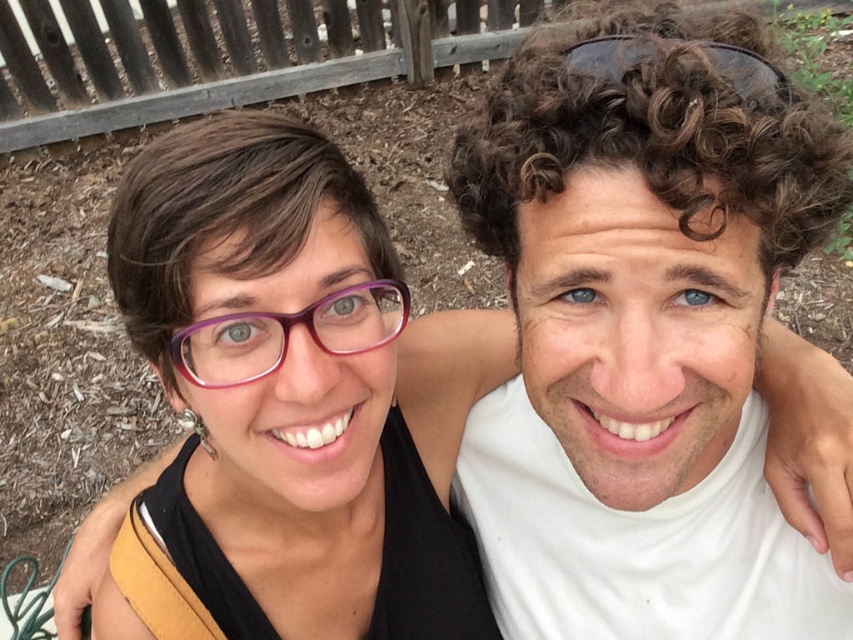
Is matte black tank top at center below purple acetate glasses at center?

Indeed, matte black tank top at center is positioned under purple acetate glasses at center.

Does matte black tank top at center have a larger size compared to purple acetate glasses at center?

Yes, matte black tank top at center is bigger than purple acetate glasses at center.

You are a GUI agent. You are given a task and a screenshot of the screen. Output one action in this format:
    pyautogui.click(x=<x>, y=<y>)
    Task: Click on the matte black tank top at center
    The image size is (853, 640).
    Given the screenshot: What is the action you would take?
    pyautogui.click(x=289, y=401)

Is purple acetate glasses at center bigger than sunglasses at upper center?

Correct, purple acetate glasses at center is larger in size than sunglasses at upper center.

Is purple acetate glasses at center to the right of sunglasses at upper center from the viewer's perspective?

Incorrect, purple acetate glasses at center is not on the right side of sunglasses at upper center.

Between point (387, 289) and point (757, 99), which one is positioned in front?

Point (757, 99) is more forward.

Locate an element on the screen. The width and height of the screenshot is (853, 640). purple acetate glasses at center is located at coordinates (288, 333).

Is matte black tank top at center below sunglasses at upper center?

Yes.

Can you confirm if matte black tank top at center is positioned to the left of sunglasses at upper center?

Yes, matte black tank top at center is to the left of sunglasses at upper center.

Is point (160, 276) less distant than point (622, 61)?

No, it is not.

Locate an element on the screen. This screenshot has height=640, width=853. matte black tank top at center is located at coordinates (289, 401).